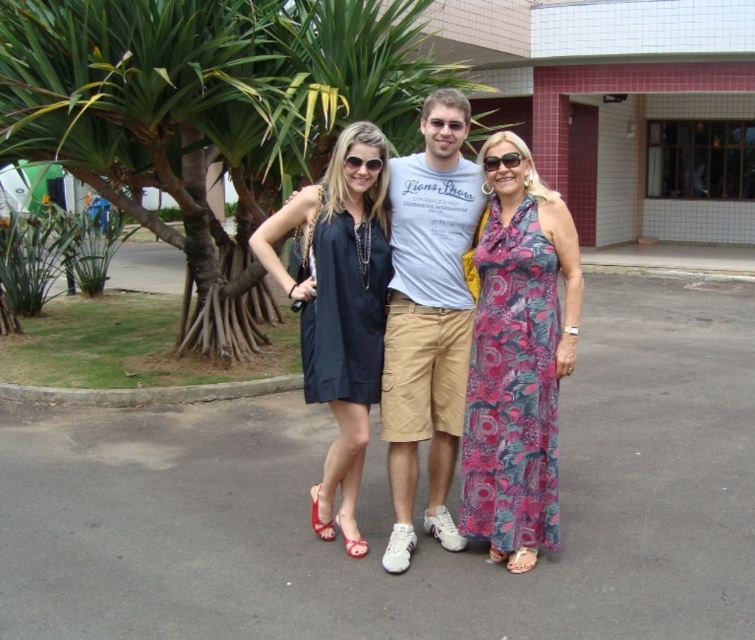
Looking at this image, you are planning to take a photo of the green leafy palm tree at center and the floral print fabric dress at center. Which object is wider when viewed from your current position?

The green leafy palm tree at center is wider than the floral print fabric dress at center.

Based on the photo, you are a photographer trying to capture a clear shot of the floral print fabric dress at center and the green leafy palm tree at center. Which object is blocking the view of the other?

The green leafy palm tree at center is blocking the view of the floral print fabric dress at center because the dress is behind the tree.